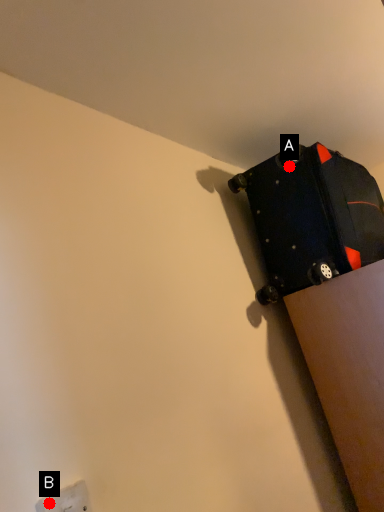
Question: Two points are circled on the image, labeled by A and B beside each circle. Among these points, which one is farthest from the camera?

Choices:
 (A) A is further
 (B) B is further

Answer: (A)